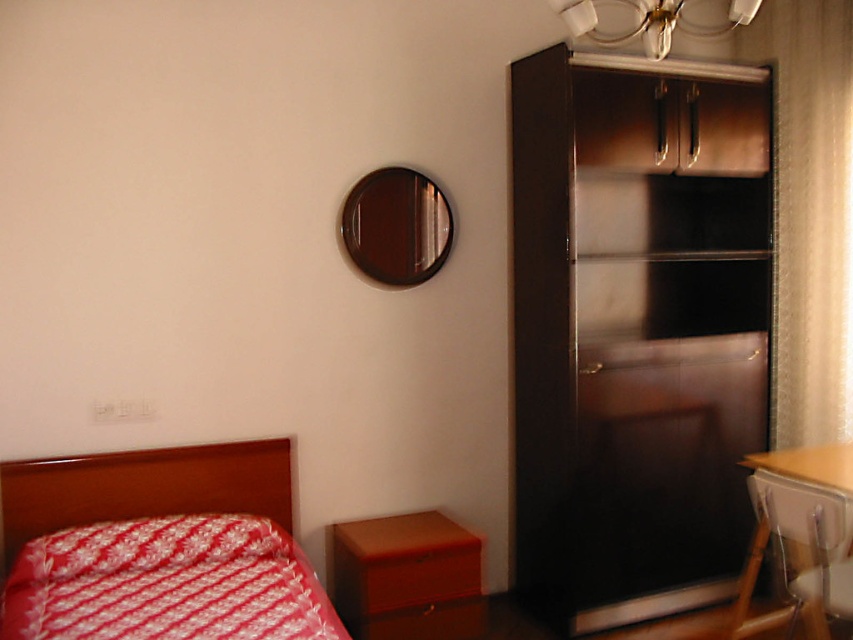
Question: Is red woven fabric bed at lower left wider than metallic silver drawer at upper right?

Choices:
 (A) yes
 (B) no

Answer: (A)

Question: Which point is farther to the camera?

Choices:
 (A) (648, 32)
 (B) (122, 621)
 (C) (712, 412)

Answer: (C)

Question: Which point is farther to the camera?

Choices:
 (A) [12, 536]
 (B) [776, 522]

Answer: (A)

Question: Does metallic silver drawer at upper right lie behind wooden chair at lower right?

Choices:
 (A) yes
 (B) no

Answer: (A)

Question: Which is farther from the metallic silver drawer at upper right?

Choices:
 (A) matte brown drawer at lower center
 (B) metallic brass chandelier at upper center
 (C) black glossy cabinet at right
 (D) red woven fabric bed at lower left

Answer: (D)

Question: Considering the relative positions of black glossy cabinet at right and sheer beige curtain at right in the image provided, where is black glossy cabinet at right located with respect to sheer beige curtain at right?

Choices:
 (A) right
 (B) left

Answer: (B)